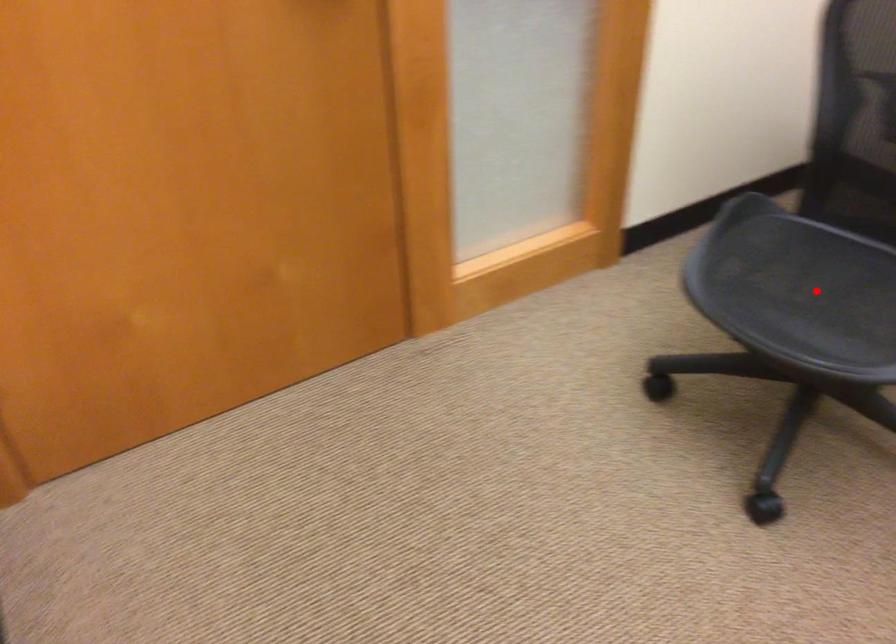
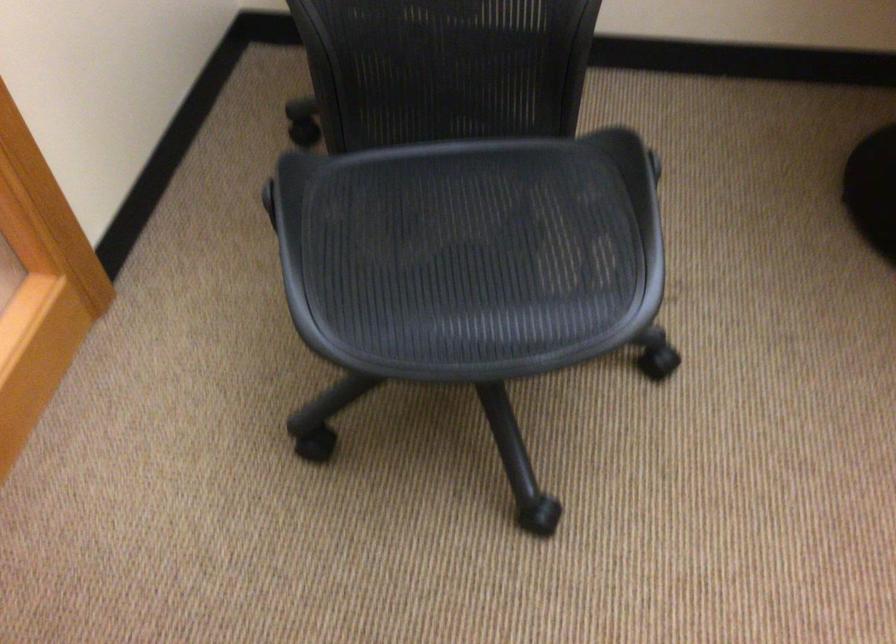
Question: A red point is marked in image1. In image2, is the corresponding 3D point closer to the camera or farther? Reply with the corresponding letter.

Choices:
 (A) The corresponding 3D point is closer.
 (B) The corresponding 3D point is farther.

Answer: (A)